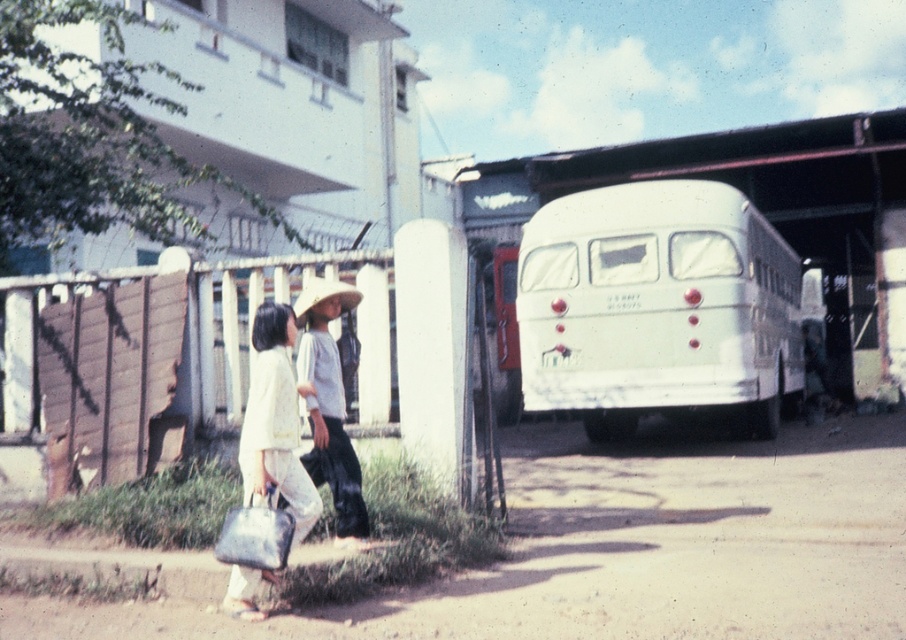
Locate an element on the screen. white matte dress at lower left is located at coordinates (275, 422).

Who is taller, white matte dress at lower left or strawmaterial/texturehat at upper center?

With more height is white matte dress at lower left.

Is point (242, 589) farther from viewer compared to point (325, 288)?

That is False.

Identify the location of white matte dress at lower left. (275, 422).

Between point (739, 376) and point (306, 291), which one is positioned behind?

Positioned behind is point (739, 376).

Does white matte bus at center have a smaller size compared to white matte hat at center?

No.

Is point (750, 264) less distant than point (348, 476)?

No, it is behind (348, 476).

The width and height of the screenshot is (906, 640). In order to click on white matte bus at center in this screenshot , I will do `click(656, 305)`.

Between white matte bus at center and white matte dress at lower left, which one appears on the left side from the viewer's perspective?

white matte dress at lower left

Is point (583, 348) farther from camera compared to point (255, 310)?

Yes, it is behind point (255, 310).

Which is behind, point (726, 184) or point (307, 384)?

The point (726, 184) is behind.

Identify the location of white matte bus at center. (656, 305).